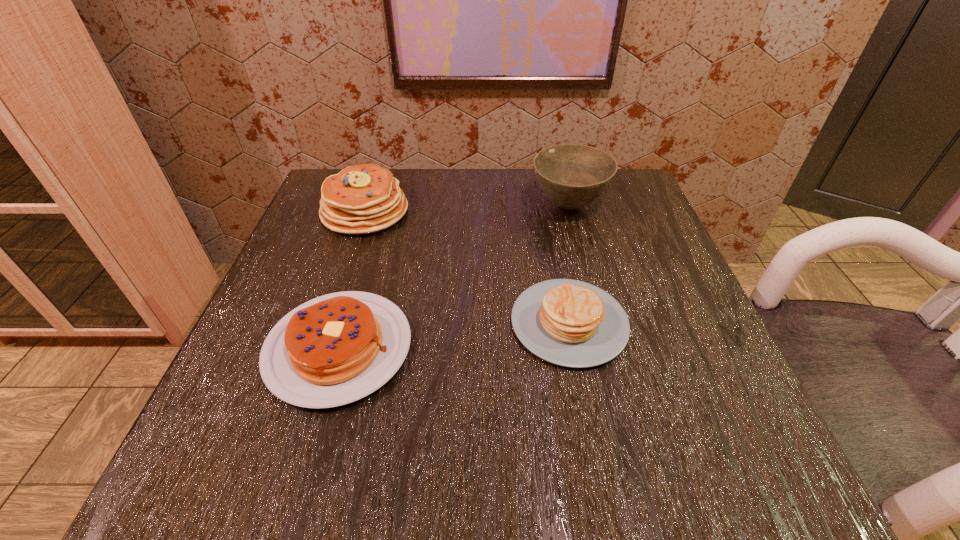
Find the location of a particular element. This screenshot has height=540, width=960. object positioned at the far left corner is located at coordinates (361, 199).

The height and width of the screenshot is (540, 960). I want to click on object at the far right corner, so click(572, 176).

In the image, there is a desktop. Find the location of `vacant region at the far edge`. vacant region at the far edge is located at coordinates (492, 180).

What are the coordinates of `free spot at the left edge of the desktop` in the screenshot? It's located at (322, 275).

Identify the location of vacant space at the right edge. The width and height of the screenshot is (960, 540). (632, 251).

The image size is (960, 540). I want to click on vacant space at the far right corner of the desktop, so click(x=634, y=201).

This screenshot has width=960, height=540. Identify the location of free region at the near right corner of the desktop. (716, 464).

At what (x,y) coordinates should I click in order to perform the action: click on vacant region between the bowl and the rightmost pancake. Please return your answer as a coordinate pair (x, y). Looking at the image, I should click on (569, 264).

You are a GUI agent. You are given a task and a screenshot of the screen. Output one action in this format:
    pyautogui.click(x=<x>, y=<y>)
    Task: Click on the free space between the farthest pancake and the bowl
    The image size is (960, 540).
    Given the screenshot: What is the action you would take?
    pyautogui.click(x=467, y=208)

Where is `free space between the bowl and the rightmost pancake`? This screenshot has width=960, height=540. free space between the bowl and the rightmost pancake is located at coordinates (569, 264).